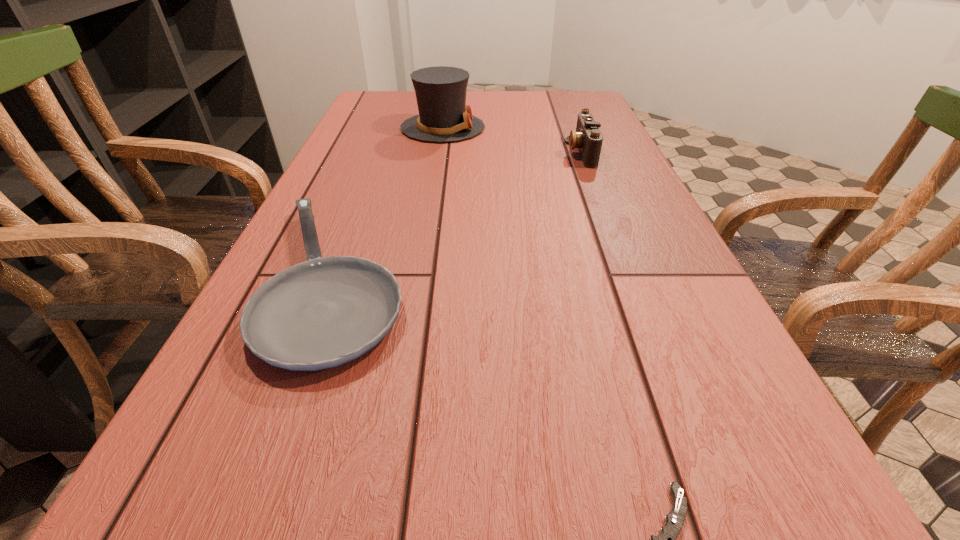
At what (x,y) coordinates should I click in order to perform the action: click on vacant space that is in between the dress hat and the camera. Please return your answer as a coordinate pair (x, y). This screenshot has width=960, height=540. Looking at the image, I should click on (512, 140).

Locate an element on the screen. This screenshot has width=960, height=540. free space between the third shortest object and the second nearest object is located at coordinates pos(459,216).

In order to click on empty location between the frying pan and the second tallest object in this screenshot , I will do `click(459, 216)`.

Where is `vacant area between the third tallest object and the tallest object`? vacant area between the third tallest object and the tallest object is located at coordinates (390, 204).

The height and width of the screenshot is (540, 960). I want to click on free space between the tallest object and the third farthest object, so click(x=390, y=204).

The height and width of the screenshot is (540, 960). In order to click on vacant space that is in between the third shortest object and the dress hat in this screenshot , I will do `click(512, 140)`.

Image resolution: width=960 pixels, height=540 pixels. I want to click on object that ranks as the second closest to the camera, so click(324, 312).

Identify which object is located as the third nearest to the shortest object. Please provide its 2D coordinates. Your answer should be formatted as a tuple, i.e. [(x, y)], where the tuple contains the x and y coordinates of a point satisfying the conditions above.

[(440, 91)]